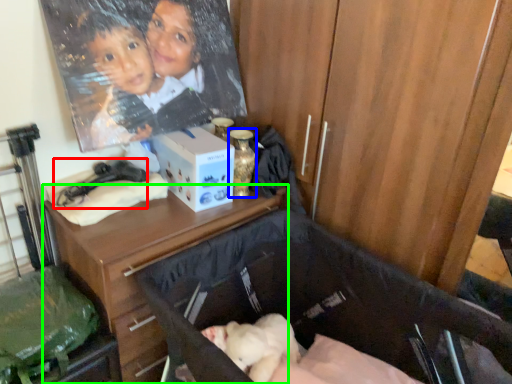
Question: Which object is the closest to the twin (highlighted by a red box)? Choose among these: bottle (highlighted by a blue box) or desk (highlighted by a green box).

Choices:
 (A) bottle
 (B) desk

Answer: (B)